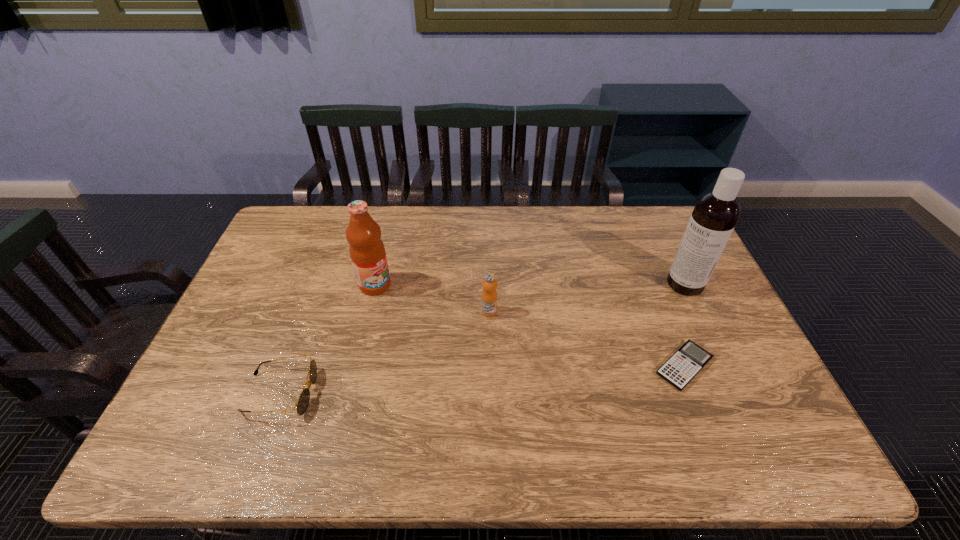
I want to click on the fourth tallest object, so click(304, 398).

Locate an element on the screen. This screenshot has width=960, height=540. the leftmost object is located at coordinates (304, 398).

This screenshot has width=960, height=540. What are the coordinates of `the shortest object` in the screenshot? It's located at (690, 359).

Identify the location of the tallest object. pyautogui.click(x=715, y=214).

This screenshot has height=540, width=960. What are the coordinates of `the third farthest object` in the screenshot? It's located at (489, 295).

Where is `orange juice`? The height and width of the screenshot is (540, 960). orange juice is located at coordinates (489, 295).

Locate an element on the screen. The width and height of the screenshot is (960, 540). the fourth shortest object is located at coordinates (367, 251).

At what (x,y) coordinates should I click in order to perform the action: click on fruit juice. Please return your answer as a coordinate pair (x, y). Looking at the image, I should click on (367, 251).

The height and width of the screenshot is (540, 960). I want to click on vacant region located on the front-facing side of the fourth tallest object, so click(358, 393).

At what (x,y) coordinates should I click in order to perform the action: click on vacant space located 0.290m on the left of the calculator. Please return your answer as a coordinate pair (x, y). This screenshot has width=960, height=540. Looking at the image, I should click on (542, 366).